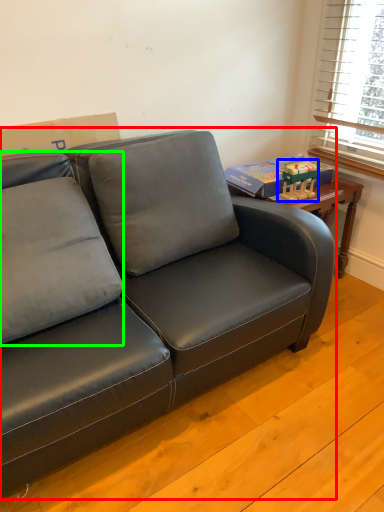
Question: Estimate the real-world distances between objects in this image. Which object is farther from studio couch (highlighted by a red box), toy (highlighted by a blue box) or pillow (highlighted by a green box)?

Choices:
 (A) toy
 (B) pillow

Answer: (A)